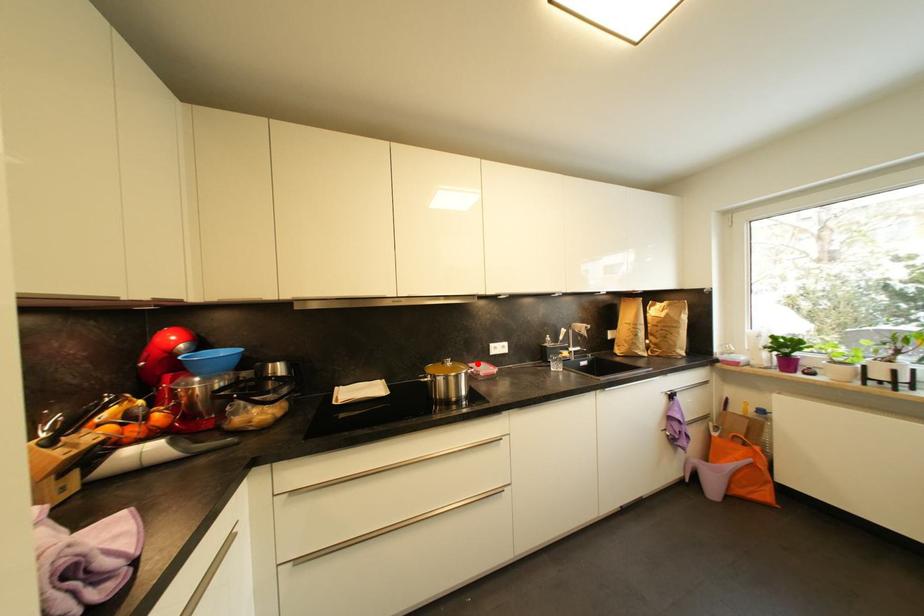
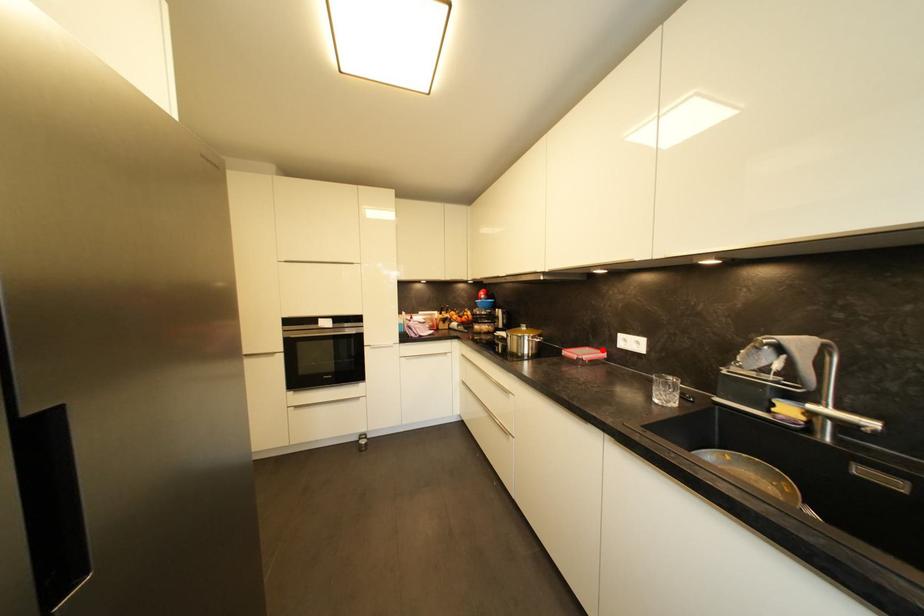
I am providing you with two images of the same scene from different viewpoints. A red point is marked on the first image and another point is marked on the second image. Is the marked point in image1 the same physical position as the marked point in image2?

Yes